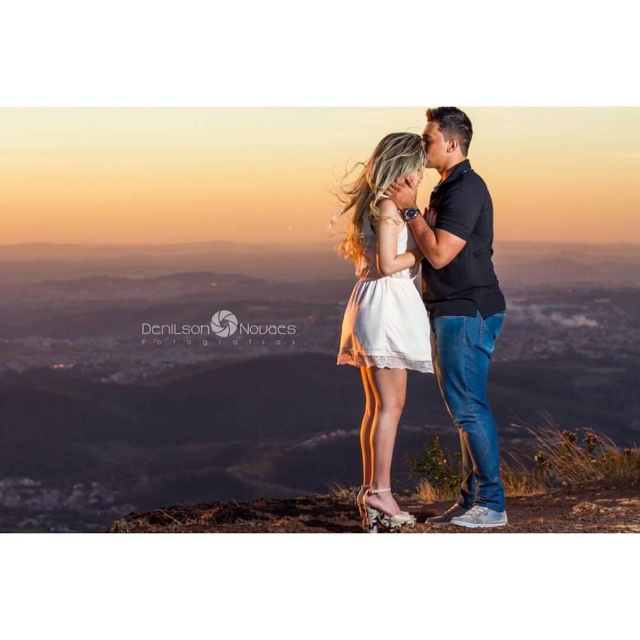
Question: Is black cotton shirt at center positioned before white lace dress at center?

Choices:
 (A) no
 (B) yes

Answer: (A)

Question: Which of the following is the closest to the observer?

Choices:
 (A) white lace dress at center
 (B) black cotton shirt at center

Answer: (A)

Question: Does black cotton shirt at center appear on the right side of white lace dress at center?

Choices:
 (A) no
 (B) yes

Answer: (B)

Question: Does black cotton shirt at center have a larger size compared to white lace dress at center?

Choices:
 (A) yes
 (B) no

Answer: (A)

Question: Which of the following is the closest to the observer?

Choices:
 (A) (428, 296)
 (B) (353, 353)

Answer: (B)